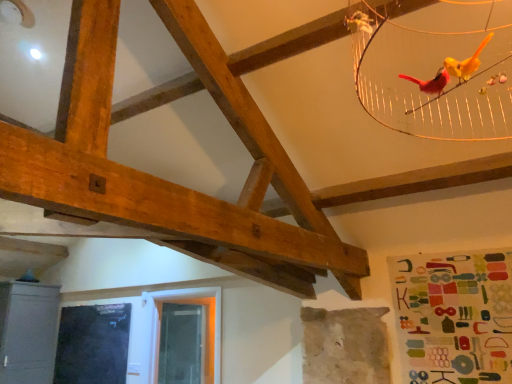
Question: From a real-world perspective, is transparent plastic window screen at lower center, the 1th window screen positioned from the right, positioned above or below metallic gray cabinet at lower left?

Choices:
 (A) below
 (B) above

Answer: (A)

Question: Considering the positions of transparent plastic window screen at lower center, the 1th window screen positioned from the right, and metallic gray cabinet at lower left in the image, is transparent plastic window screen at lower center, the 1th window screen positioned from the right, wider or thinner than metallic gray cabinet at lower left?

Choices:
 (A) thin
 (B) wide

Answer: (A)

Question: Which of these objects is positioned farthest from the metallic gray cabinet at lower left?

Choices:
 (A) black glass window screen at lower left, placed as the 2th window screen when sorted from right to left
 (B) transparent plastic window screen at lower center, which is the second window screen in left-to-right order

Answer: (B)

Question: Which is farther from the black glass window screen at lower left, placed as the 2th window screen when sorted from right to left?

Choices:
 (A) metallic gray cabinet at lower left
 (B) transparent plastic window screen at lower center, which is the second window screen in left-to-right order

Answer: (B)